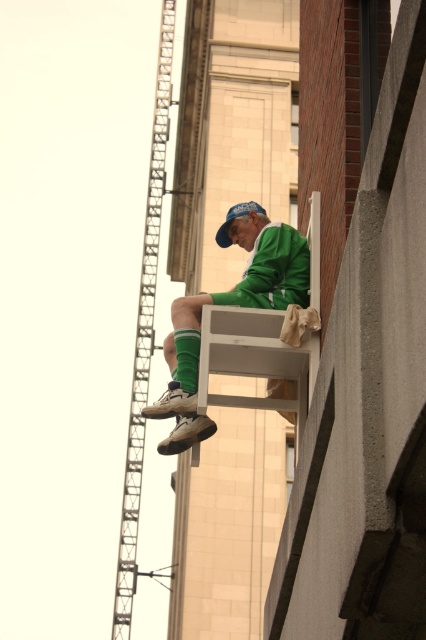
Question: Among these objects, which one is nearest to the camera?

Choices:
 (A) green matte jacket at center
 (B) blue fabric cap at center

Answer: (A)

Question: Does green matte jacket at center have a greater width compared to blue fabric cap at center?

Choices:
 (A) no
 (B) yes

Answer: (B)

Question: Can you confirm if green matte jacket at center is positioned below blue fabric cap at center?

Choices:
 (A) no
 (B) yes

Answer: (B)

Question: Does green matte jacket at center come in front of blue fabric cap at center?

Choices:
 (A) no
 (B) yes

Answer: (B)